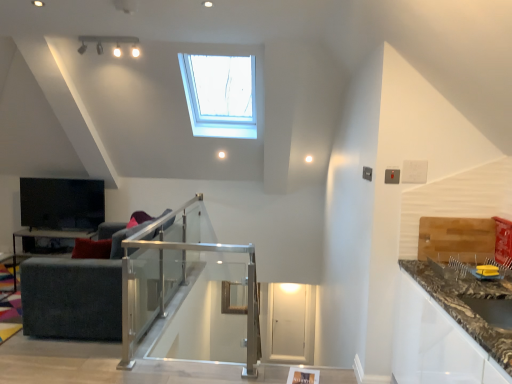
Locate an element on the screen. The width and height of the screenshot is (512, 384). vacant area situated below clear glass balustrade at center (from a real-world perspective) is located at coordinates (178, 367).